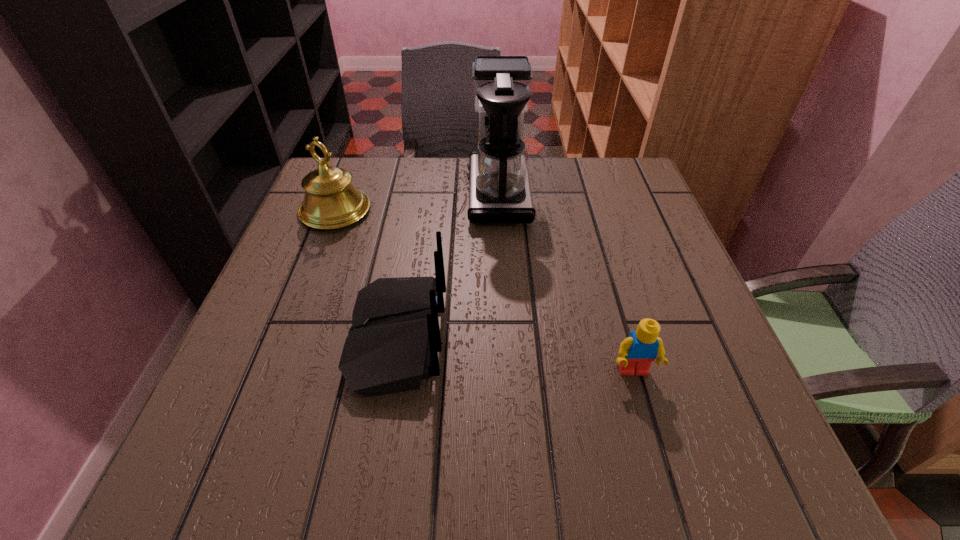
Where is `vacant space at the right edge`? This screenshot has height=540, width=960. vacant space at the right edge is located at coordinates (677, 306).

The width and height of the screenshot is (960, 540). I want to click on vacant region at the far left corner, so click(383, 172).

The image size is (960, 540). What are the coordinates of `vacant space at the far right corner of the desktop` in the screenshot? It's located at [612, 194].

The width and height of the screenshot is (960, 540). I want to click on blank space at the near right corner of the desktop, so click(770, 449).

The height and width of the screenshot is (540, 960). I want to click on vacant space in between the coffee maker and the second object from left to right, so click(x=447, y=266).

Locate an element on the screen. vacant space that's between the tallest object and the third object from right to left is located at coordinates (447, 266).

The width and height of the screenshot is (960, 540). Identify the location of blank region between the leftmost object and the rightmost object. (484, 291).

I want to click on free space between the leftmost object and the second object from left to right, so click(x=366, y=274).

The image size is (960, 540). In order to click on vacant area between the leftmost object and the coffee maker in this screenshot , I will do `click(417, 202)`.

This screenshot has height=540, width=960. In order to click on vacant area that lies between the second object from left to right and the leftmost object in this screenshot , I will do `click(366, 274)`.